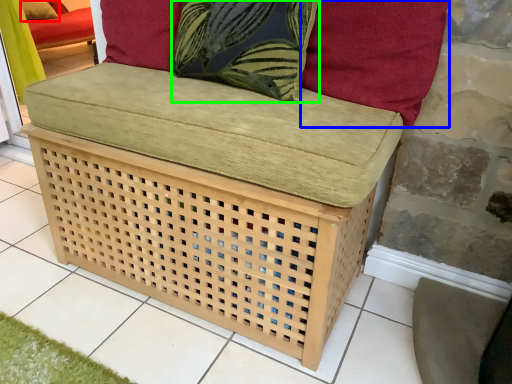
Question: Which object is positioned closest to pillow (highlighted by a red box)? Select from pillow (highlighted by a blue box) and throw pillow (highlighted by a green box).

Choices:
 (A) pillow
 (B) throw pillow

Answer: (B)